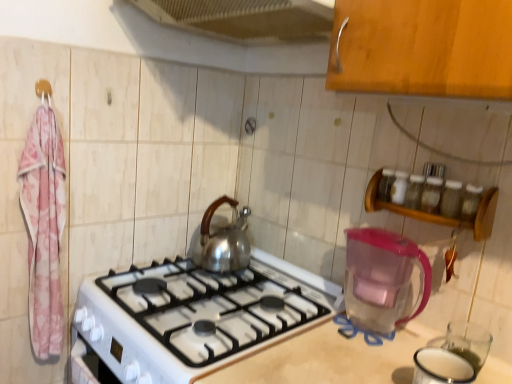
You are a GUI agent. You are given a task and a screenshot of the screen. Output one action in this format:
    pyautogui.click(x=<x>, y=<y>)
    Task: Click on the empty space that is ontop of transparent plastic pitcher at lower right (from a real-world perspective)
    
    Given the screenshot: What is the action you would take?
    pyautogui.click(x=376, y=232)